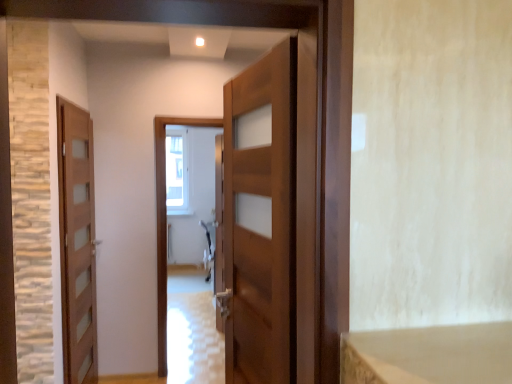
Question: Can you confirm if clear glass window at center is positioned to the left of wooden door at center, which ranks as the 1th door in front-to-back order?

Choices:
 (A) yes
 (B) no

Answer: (A)

Question: Does clear glass window at center lie in front of wooden door at center, positioned as the first door in right-to-left order?

Choices:
 (A) no
 (B) yes

Answer: (A)

Question: Does clear glass window at center come behind wooden door at center, which ranks as the 1th door in front-to-back order?

Choices:
 (A) no
 (B) yes

Answer: (B)

Question: Can you confirm if clear glass window at center is thinner than wooden door at center, marked as the 2th door in a back-to-front arrangement?

Choices:
 (A) yes
 (B) no

Answer: (A)

Question: Considering the relative positions of clear glass window at center and wooden door at center, marked as the 2th door in a left-to-right arrangement, in the image provided, is clear glass window at center to the right of wooden door at center, marked as the 2th door in a left-to-right arrangement, from the viewer's perspective?

Choices:
 (A) yes
 (B) no

Answer: (B)

Question: Can you confirm if clear glass window at center is bigger than wooden door at center, marked as the 2th door in a back-to-front arrangement?

Choices:
 (A) yes
 (B) no

Answer: (B)

Question: From the image's perspective, does wooden door at left, marked as the first door in a back-to-front arrangement, appear higher than glossy wooden door at center?

Choices:
 (A) no
 (B) yes

Answer: (B)

Question: From the image's perspective, is wooden door at left, acting as the 2th door starting from the right, beneath glossy wooden door at center?

Choices:
 (A) yes
 (B) no

Answer: (B)

Question: Does wooden door at left, acting as the 2th door starting from the right, have a greater width compared to glossy wooden door at center?

Choices:
 (A) no
 (B) yes

Answer: (A)

Question: Can you confirm if wooden door at left, which ranks as the first door in left-to-right order, is thinner than glossy wooden door at center?

Choices:
 (A) yes
 (B) no

Answer: (A)

Question: Does wooden door at left, acting as the 2th door starting from the right, have a lesser height compared to glossy wooden door at center?

Choices:
 (A) yes
 (B) no

Answer: (B)

Question: Is wooden door at left, which is the 2th door in front-to-back order, at the left side of glossy wooden door at center?

Choices:
 (A) yes
 (B) no

Answer: (A)

Question: From a real-world perspective, is wooden door at center, marked as the 2th door in a left-to-right arrangement, below glossy wooden door at center?

Choices:
 (A) yes
 (B) no

Answer: (B)